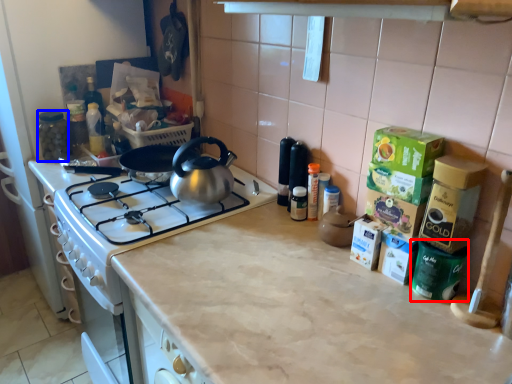
Question: Which object appears farthest to the camera in this image, appliance (highlighted by a red box) or appliance (highlighted by a blue box)?

Choices:
 (A) appliance
 (B) appliance

Answer: (B)